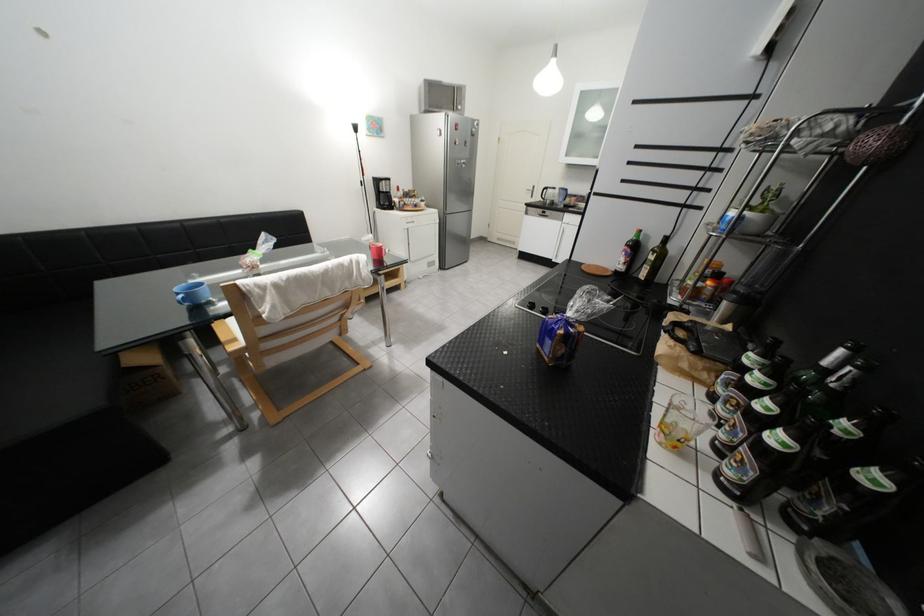
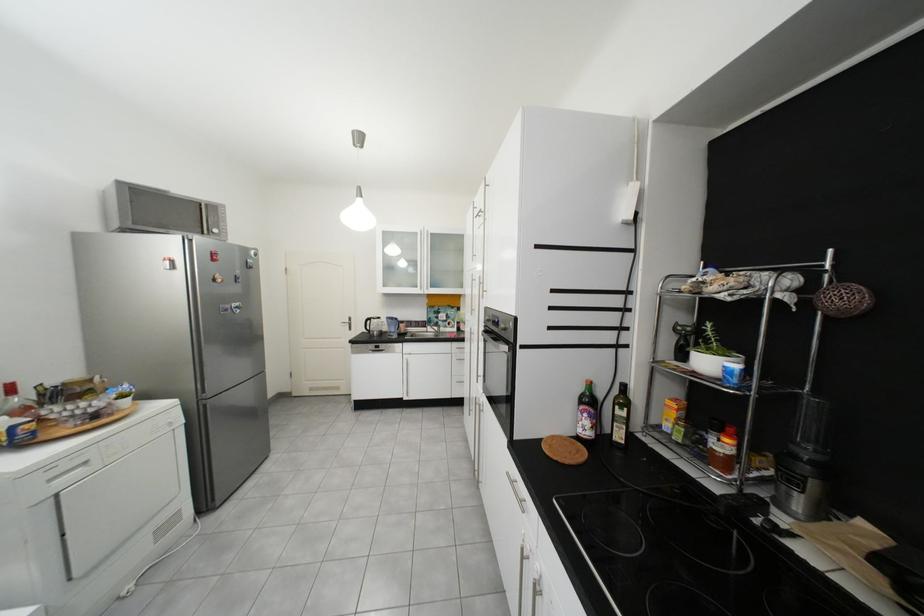
Find the pixel in the second image that matches point 638,246 in the first image.

(592, 403)